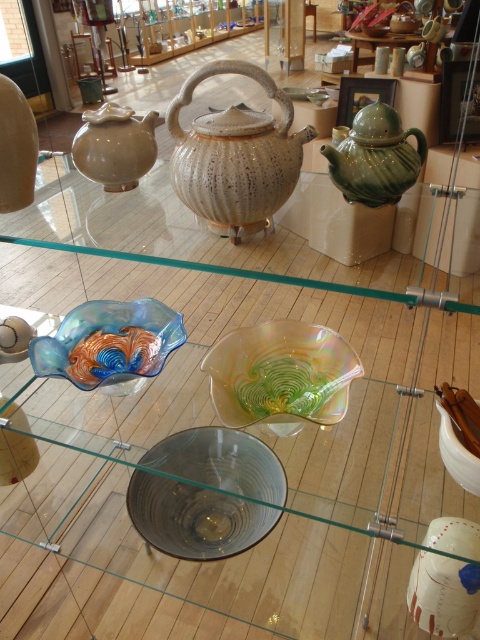
Is translucent iridescent bowl at center thinner than green glazed teapot at upper right?

Incorrect, translucent iridescent bowl at center's width is not less than green glazed teapot at upper right's.

Is translucent iridescent bowl at center wider than green glazed teapot at upper right?

Yes.

Which is in front, point (113, 371) or point (368, 108)?

Point (368, 108) is in front.

Identify the location of translucent iridescent bowl at center. click(x=108, y=342).

Does iridescent glass bowl at center appear on the left side of matte white bowl at lower right?

Indeed, iridescent glass bowl at center is positioned on the left side of matte white bowl at lower right.

Does iridescent glass bowl at center appear on the right side of matte white bowl at lower right?

Incorrect, iridescent glass bowl at center is not on the right side of matte white bowl at lower right.

What are the coordinates of `iridescent glass bowl at center` in the screenshot? It's located at (280, 374).

Is iridescent glass bowl at center taller than translucent glass bowl at center?

Indeed, iridescent glass bowl at center has a greater height compared to translucent glass bowl at center.

Which is behind, point (274, 428) or point (324, 93)?

Positioned behind is point (324, 93).

What are the coordinates of `iridescent glass bowl at center` in the screenshot? It's located at (280, 374).